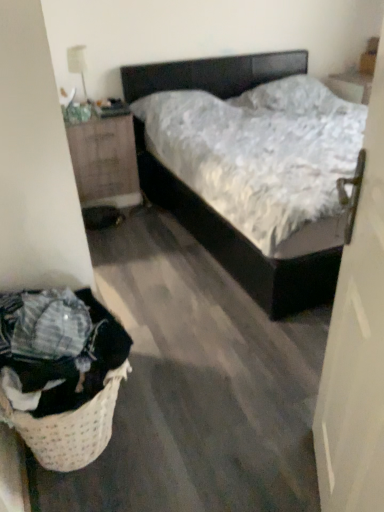
Question: Would you say matte black bed at center is inside or outside white matte door at right?

Choices:
 (A) inside
 (B) outside

Answer: (B)

Question: Considering the positions of point (244, 256) and point (360, 404), is point (244, 256) closer or farther from the camera than point (360, 404)?

Choices:
 (A) farther
 (B) closer

Answer: (A)

Question: Estimate the real-world distances between objects in this image. Which object is farther from the wooden nightstand at left?

Choices:
 (A) woven beige laundry basket at lower left
 (B) white matte door at right
 (C) white glossy lamp at upper left
 (D) matte black bed at center

Answer: (B)

Question: Considering the real-world distances, which object is farthest from the white glossy lamp at upper left?

Choices:
 (A) white matte door at right
 (B) matte black bed at center
 (C) woven beige laundry basket at lower left
 (D) wooden nightstand at left

Answer: (A)